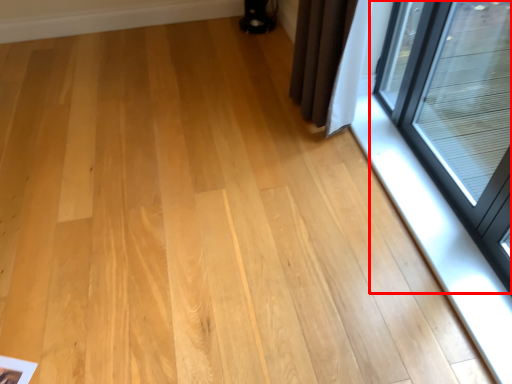
Question: From the image's perspective, where is window (annotated by the red box) located relative to window sill?

Choices:
 (A) above
 (B) below

Answer: (A)